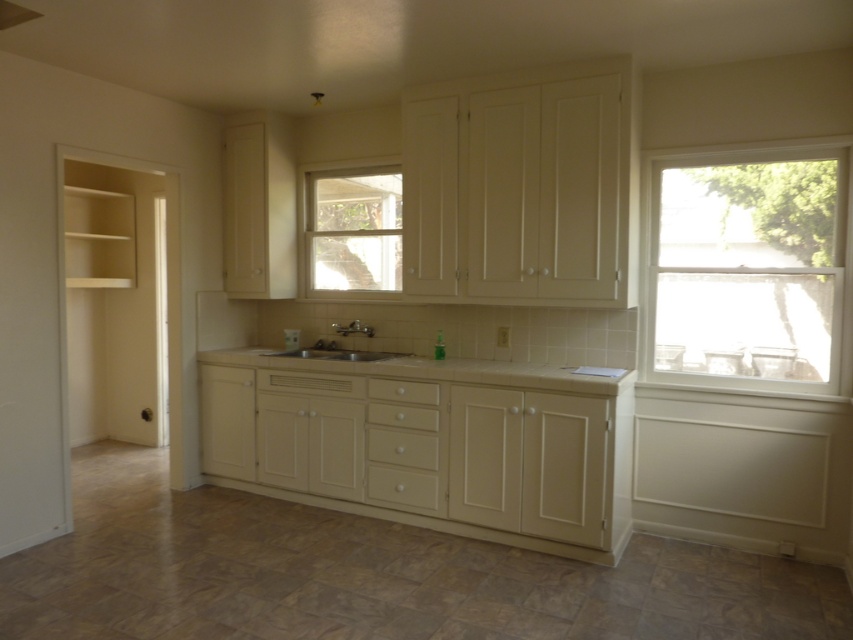
You are a chef preparing to place a large cutting board on the countertop. Considering the white laminate countertop at center and the beige tile countertop at center, which one has enough space to accommodate the board?

The beige tile countertop at center has a greater width than the white laminate countertop at center, so it can accommodate the large cutting board better.

You are standing in the kitchen and want to reach both the point at coordinates point [248,420] and the point at coordinates point [416,369]. Which point will you need to stretch your arm less to reach?

Point [248,420] is closer to you than point [416,369], so you will need to stretch your arm less to reach point [248,420].

You are standing in the kitchen and want to move from the sink to the faucet. Which point, point (x=606, y=499) or point (x=364, y=221), is closer to you?

Point (x=606, y=499) is closer to you because it is in front of point (x=364, y=221).